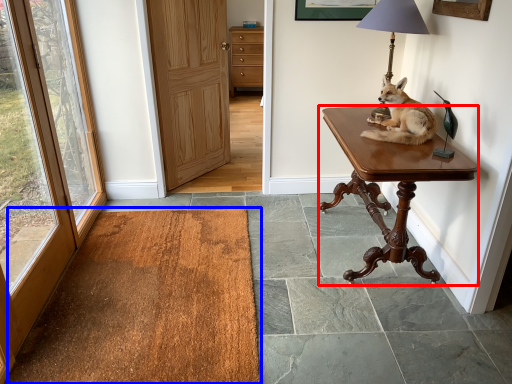
Question: Which of the following is the closest to the observer, desk (highlighted by a red box) or mat (highlighted by a blue box)?

Choices:
 (A) desk
 (B) mat

Answer: (B)